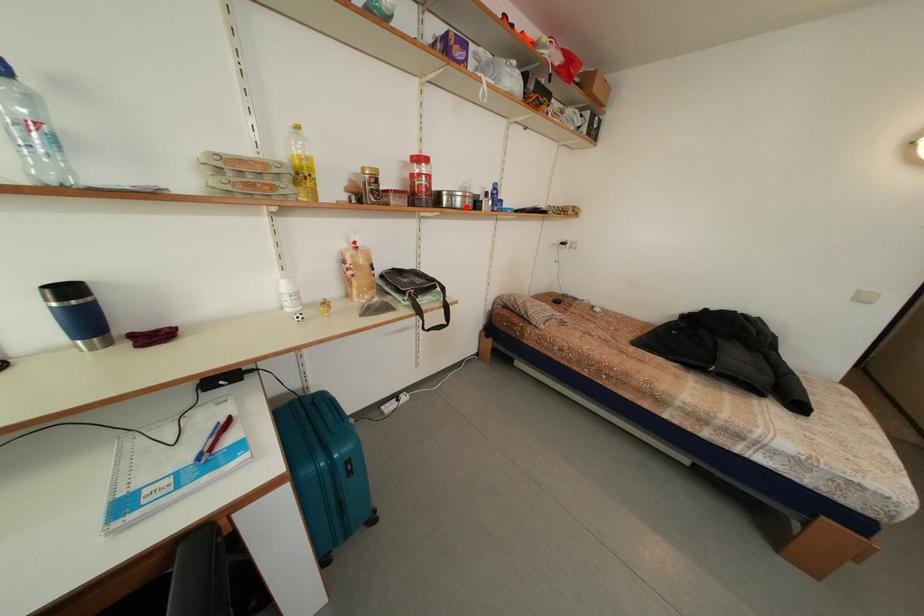
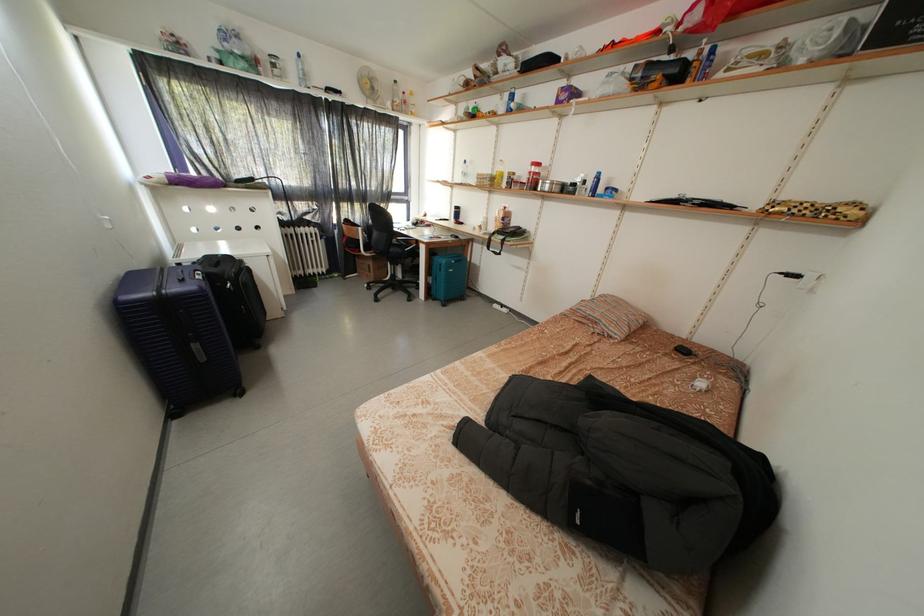
Find the pixel in the second image that matches the highlighted location in the first image.

(554, 193)